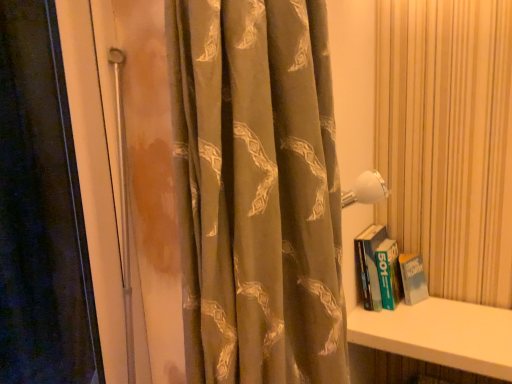
I want to click on silky brown curtain at center, so click(257, 191).

Locate an element on the screen. white smooth shelf at lower right is located at coordinates (440, 334).

Considering the positions of objects green matte book at right and white smooth shelf at lower right in the image provided, who is more to the left, green matte book at right or white smooth shelf at lower right?

Positioned to the left is green matte book at right.

What's the angular difference between green matte book at right and white smooth shelf at lower right's facing directions?

There is a 0.00102-degree angle between the facing directions of green matte book at right and white smooth shelf at lower right.

Could you tell me if green matte book at right is turned towards white smooth shelf at lower right?

No, green matte book at right does not turn towards white smooth shelf at lower right.

Considering the relative sizes of green matte book at right and white smooth shelf at lower right in the image provided, is green matte book at right thinner than white smooth shelf at lower right?

Yes.

Looking at their sizes, would you say white smooth shelf at lower right is wider or thinner than green matte book at right?

Considering their sizes, white smooth shelf at lower right looks broader than green matte book at right.

Between white smooth shelf at lower right and green matte book at right, which one has larger size?

With larger size is white smooth shelf at lower right.

How distant is silky brown curtain at center from green matte book at right?

The distance of silky brown curtain at center from green matte book at right is 35.35 inches.

Where is `curtain above the green matte book at right (from the image's perspective)`? curtain above the green matte book at right (from the image's perspective) is located at coordinates (257, 191).

In the scene shown: How many degrees apart are the facing directions of silky brown curtain at center and green matte book at right?

The angle between the facing direction of silky brown curtain at center and the facing direction of green matte book at right is 90 degrees.

Considering the relative sizes of silky brown curtain at center and green matte book at right in the image provided, is silky brown curtain at center thinner than green matte book at right?

No.

Does green matte book at right have a greater width compared to silky brown curtain at center?

No.

Considering the relative sizes of green matte book at right and silky brown curtain at center in the image provided, is green matte book at right smaller than silky brown curtain at center?

Yes, green matte book at right is smaller than silky brown curtain at center.

Are green matte book at right and silky brown curtain at center making contact?

They are not placed beside each other.

Based on the photo, how far apart are green matte book at right and silky brown curtain at center?

green matte book at right is 35.35 inches away from silky brown curtain at center.

Considering the points (372, 313) and (251, 286), which point is behind, point (372, 313) or point (251, 286)?

The point (372, 313) is farther.

Is white smooth shelf at lower right turned away from silky brown curtain at center?

white smooth shelf at lower right does not have its back to silky brown curtain at center.

Which of these two, white smooth shelf at lower right or silky brown curtain at center, stands shorter?

white smooth shelf at lower right is shorter.

Where is `window sill on the right of the silky brown curtain at center`? This screenshot has width=512, height=384. window sill on the right of the silky brown curtain at center is located at coordinates (440, 334).

Is silky brown curtain at center behind white smooth shelf at lower right?

That is False.

Consider the image. Considering the sizes of silky brown curtain at center and white smooth shelf at lower right in the image, is silky brown curtain at center wider or thinner than white smooth shelf at lower right?

Considering their sizes, silky brown curtain at center looks slimmer than white smooth shelf at lower right.

From the image's perspective, is silky brown curtain at center on top of white smooth shelf at lower right?

Yes, from the image's perspective, silky brown curtain at center is on top of white smooth shelf at lower right.

At what (x,y) coordinates should I click in order to perform the action: click on book behind the white smooth shelf at lower right. Please return your answer as a coordinate pair (x, y). This screenshot has height=384, width=512. Looking at the image, I should click on (387, 271).

Locate an element on the screen. book located on the left of white smooth shelf at lower right is located at coordinates (387, 271).

Estimate the real-world distances between objects in this image. Which object is closer to green matte book at right, white smooth shelf at lower right or silky brown curtain at center?

white smooth shelf at lower right.

Considering their positions, is white smooth shelf at lower right positioned closer to silky brown curtain at center than green matte book at right?

white smooth shelf at lower right is closer to silky brown curtain at center.

Looking at the image, which one is located further to silky brown curtain at center, green matte book at right or white smooth shelf at lower right?

green matte book at right.

Consider the image. Estimate the real-world distances between objects in this image. Which object is further from green matte book at right, silky brown curtain at center or white smooth shelf at lower right?

Among the two, silky brown curtain at center is located further to green matte book at right.

Looking at this image, considering their positions, is silky brown curtain at center positioned further to white smooth shelf at lower right than green matte book at right?

Based on the image, silky brown curtain at center appears to be further to white smooth shelf at lower right.

Considering their positions, is green matte book at right positioned closer to white smooth shelf at lower right than silky brown curtain at center?

green matte book at right is positioned closer to the anchor white smooth shelf at lower right.

What are the coordinates of `window sill between silky brown curtain at center and green matte book at right along the z-axis` in the screenshot? It's located at (440, 334).